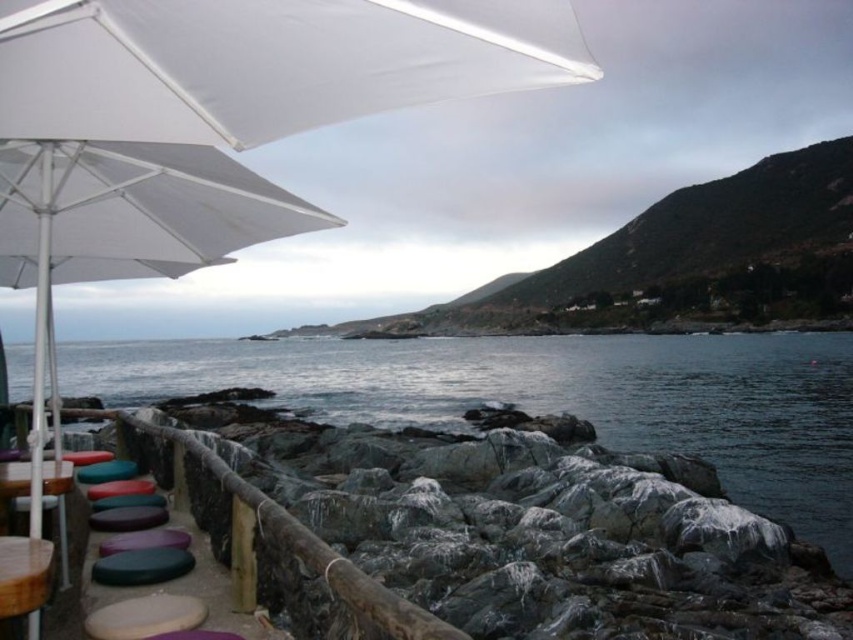
Between point (77, 268) and point (653, 410), which one is positioned in front?

Point (77, 268) is in front.

Does white matte umbrella at upper left appear under clear water at lower left?

No.

What do you see at coordinates (215, 120) in the screenshot? I see `white matte umbrella at upper left` at bounding box center [215, 120].

Where is `white matte umbrella at upper left`? This screenshot has width=853, height=640. white matte umbrella at upper left is located at coordinates (215, 120).

In order to click on clear water at lower left in this screenshot , I will do `click(555, 397)`.

How far apart are clear water at lower left and wooden table at lower left?

A distance of 47.06 meters exists between clear water at lower left and wooden table at lower left.

Between point (465, 362) and point (25, 552), which one is positioned behind?

Positioned behind is point (465, 362).

Where is `clear water at lower left`? This screenshot has width=853, height=640. clear water at lower left is located at coordinates (555, 397).

Does white matte umbrella at upper left have a smaller size compared to wooden table at lower left?

Yes.

Does white matte umbrella at upper left appear under wooden table at lower left?

Actually, white matte umbrella at upper left is above wooden table at lower left.

Where is `white matte umbrella at upper left`? The height and width of the screenshot is (640, 853). white matte umbrella at upper left is located at coordinates (215, 120).

You are a GUI agent. You are given a task and a screenshot of the screen. Output one action in this format:
    pyautogui.click(x=<x>, y=<y>)
    Task: Click on the white matte umbrella at upper left
    This screenshot has height=640, width=853.
    Given the screenshot: What is the action you would take?
    pyautogui.click(x=215, y=120)